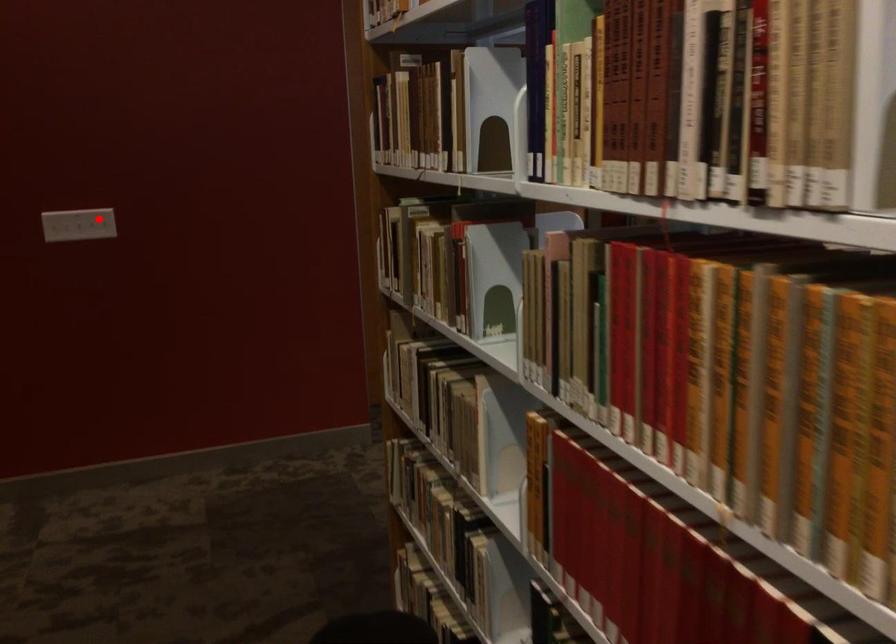
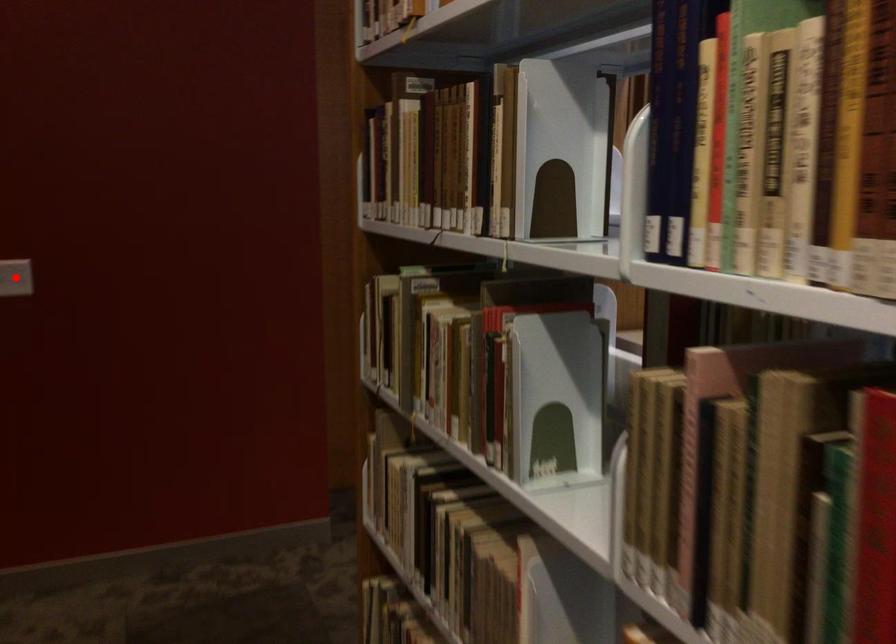
I am providing you with two images of the same scene from different viewpoints. A red point is marked on the first image and another point is marked on the second image. Does the point marked in image1 correspond to the same location as the one in image2?

Yes